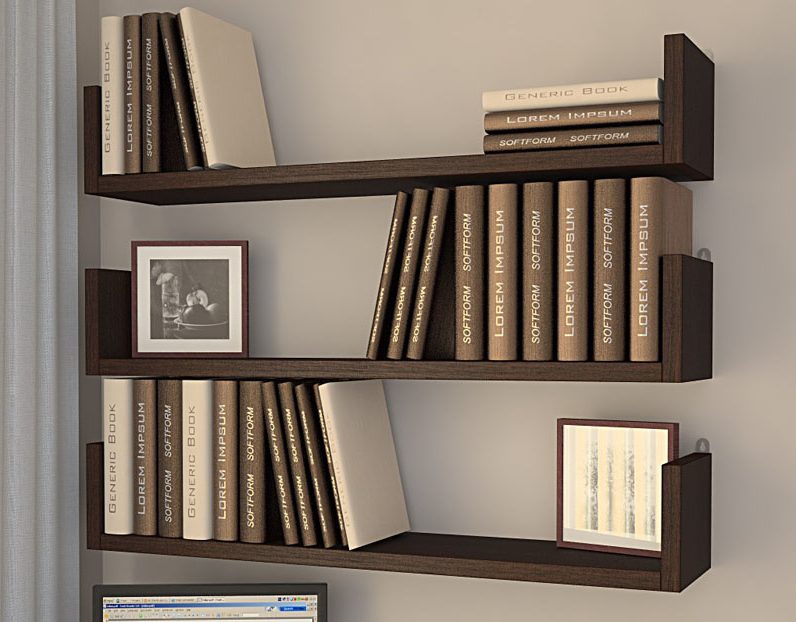
Locate an element on the screen. book on top shelf is located at coordinates (114, 123), (133, 126), (150, 127), (181, 134), (197, 129), (205, 131), (532, 144), (533, 119), (533, 96).